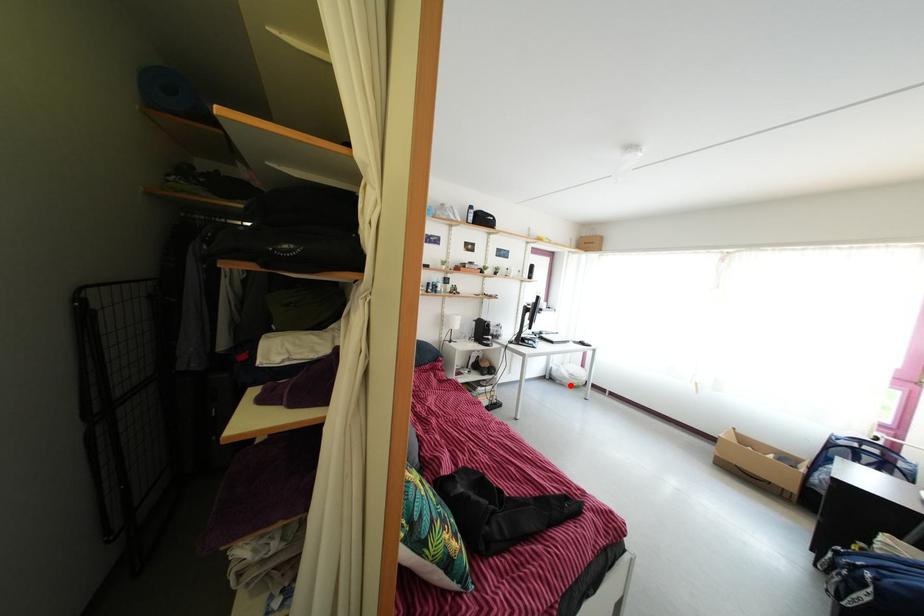
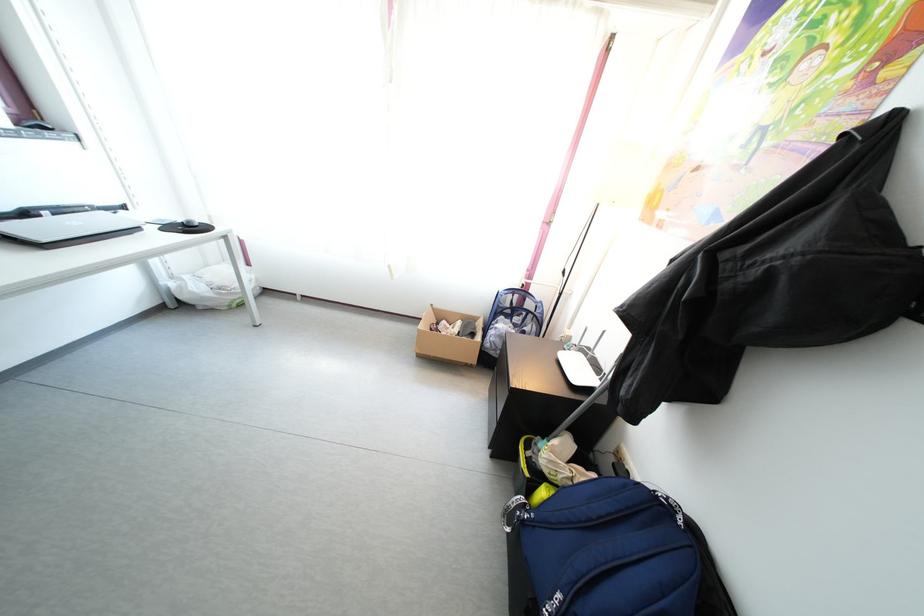
Question: A red point is marked in image1. In image2, is the corresponding 3D point closer to the camera or farther? Reply with the corresponding letter.

Choices:
 (A) The corresponding 3D point is closer.
 (B) The corresponding 3D point is farther.

Answer: (A)